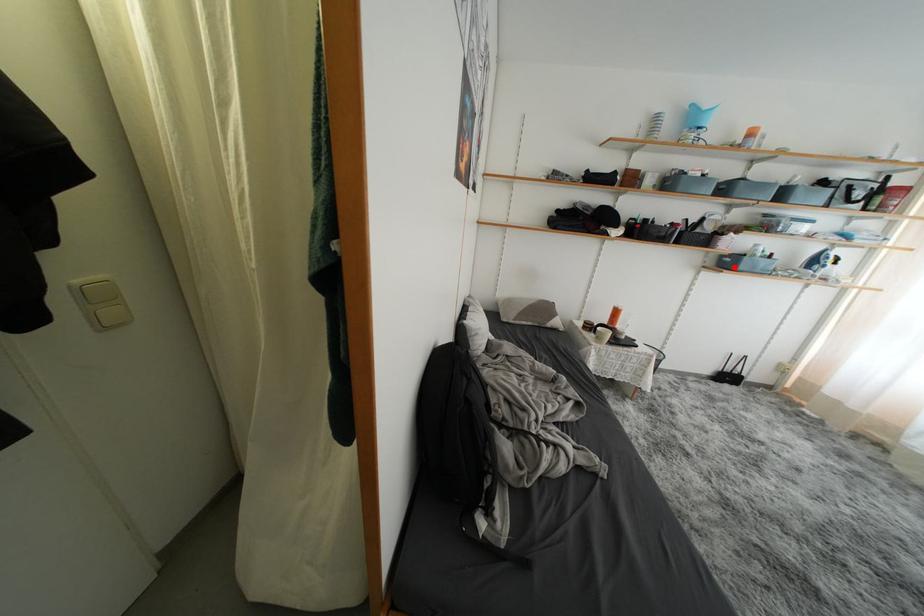
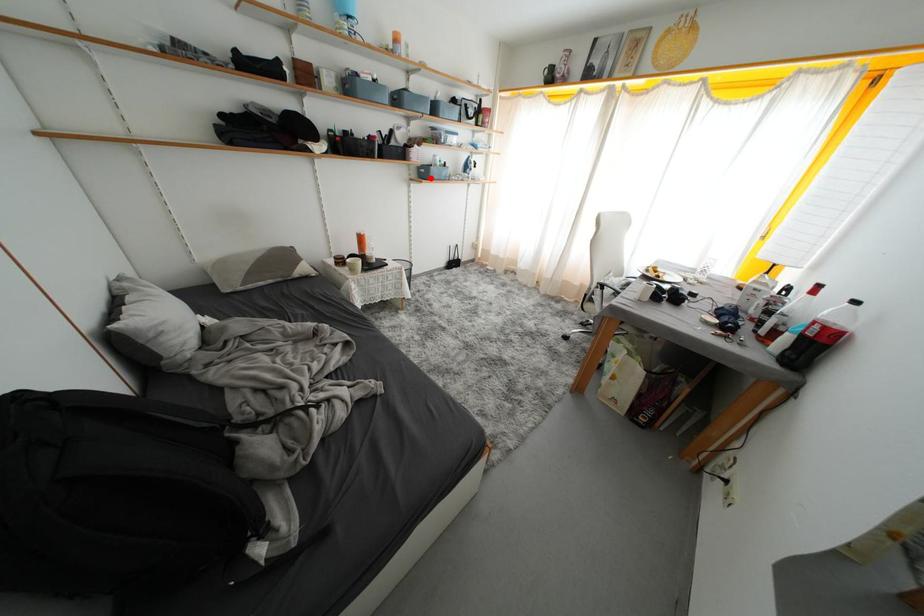
I am providing you with two images of the same scene from different viewpoints. A red point is marked on the first image and another point is marked on the second image. Do the highlighted points in image1 and image2 indicate the same real-world spot?

Yes